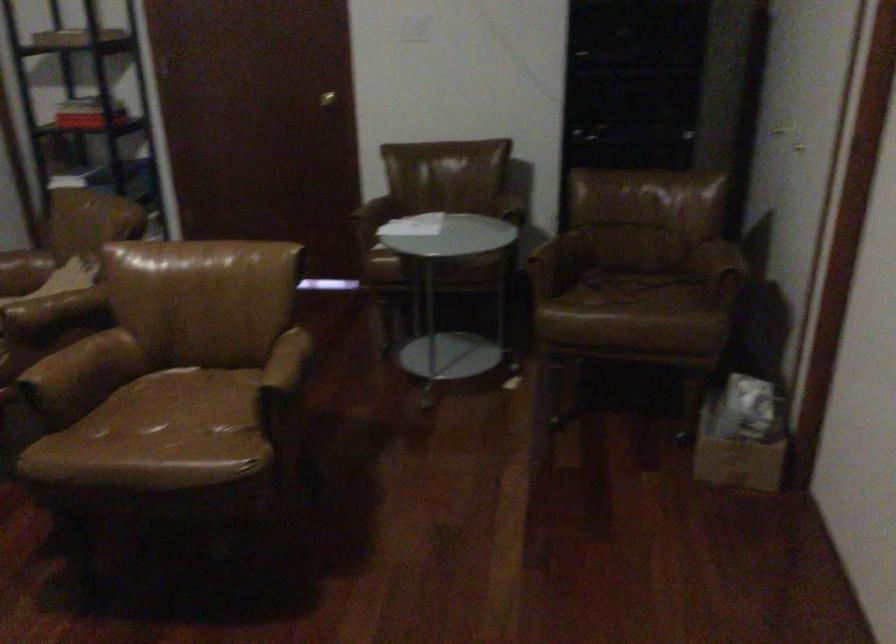
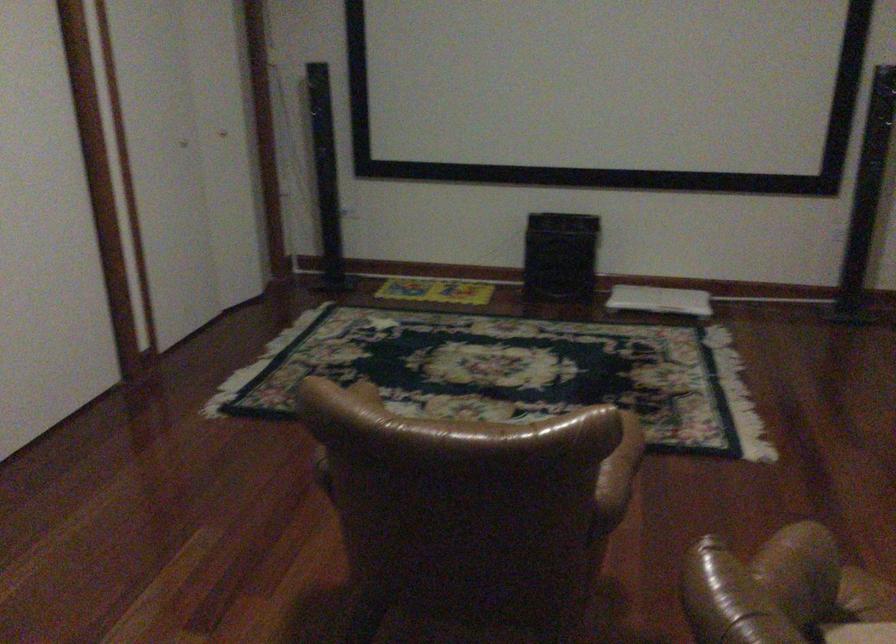
Question: I am providing you with two images of the same scene from different viewpoints. Please identify which objects are invisible in image2.

Choices:
 (A) blue bottle pump
 (B) brown leather armrest
 (C) chair armrest
 (D) black speaker box

Answer: (C)